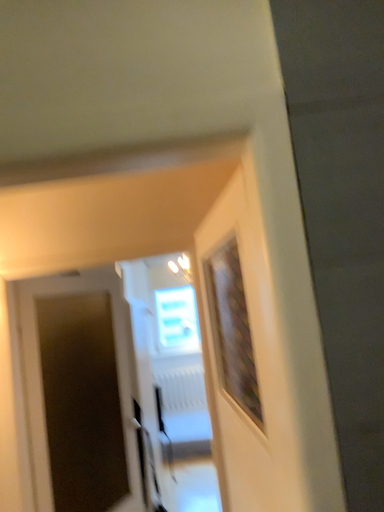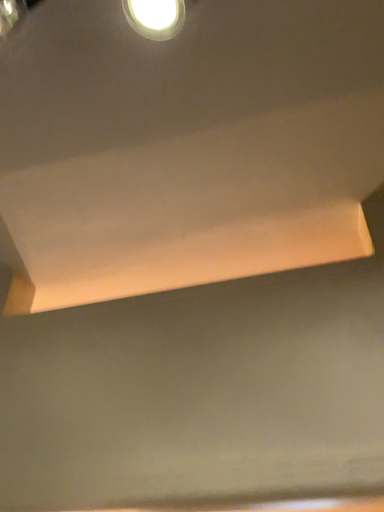
Question: Which way did the camera rotate in the video?

Choices:
 (A) rotated downward
 (B) rotated upward

Answer: (B)